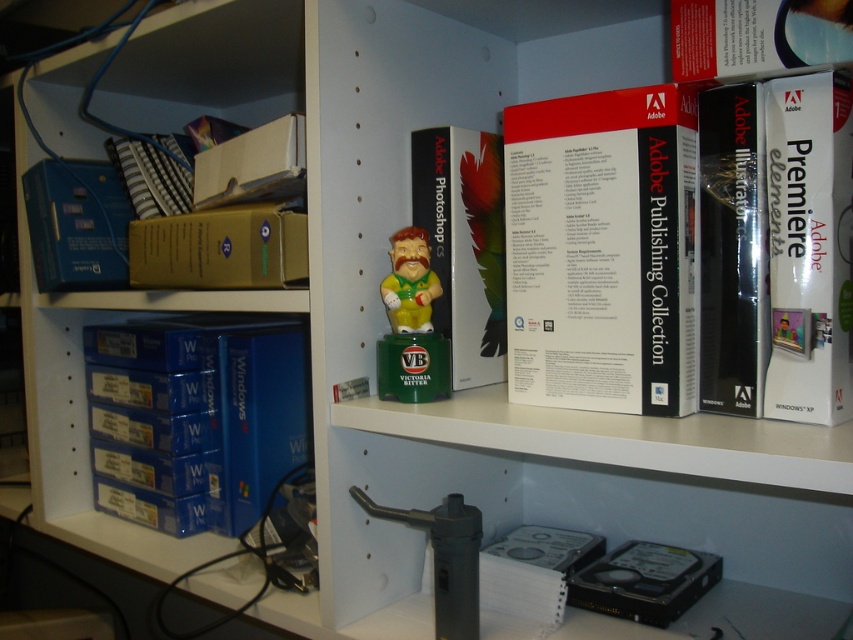
Can you confirm if blue plastic box at left is positioned to the left of blue matte box at left?

Incorrect, blue plastic box at left is not on the left side of blue matte box at left.

Does blue plastic box at left have a greater height compared to blue matte box at left?

Yes, blue plastic box at left is taller than blue matte box at left.

The width and height of the screenshot is (853, 640). Describe the element at coordinates (195, 419) in the screenshot. I see `blue plastic box at left` at that location.

Find the location of `blue plastic box at left`. blue plastic box at left is located at coordinates (195, 419).

This screenshot has height=640, width=853. What are the coordinates of `white matte adobe premiere elements at upper right` in the screenshot? It's located at (809, 248).

Between point (775, 88) and point (546, 605), which one is positioned behind?

The point (546, 605) is more distant.

What do you see at coordinates (809, 248) in the screenshot? I see `white matte adobe premiere elements at upper right` at bounding box center [809, 248].

Locate an element on the screen. The height and width of the screenshot is (640, 853). white matte adobe premiere elements at upper right is located at coordinates (809, 248).

In the scene shown: Can you confirm if white matte adobe publishing collection at center is bigger than matte plastic bobblehead at center?

Yes, white matte adobe publishing collection at center is bigger than matte plastic bobblehead at center.

Is white matte adobe publishing collection at center to the left of matte plastic bobblehead at center from the viewer's perspective?

No, white matte adobe publishing collection at center is not to the left of matte plastic bobblehead at center.

Identify the location of white matte adobe publishing collection at center. 602,250.